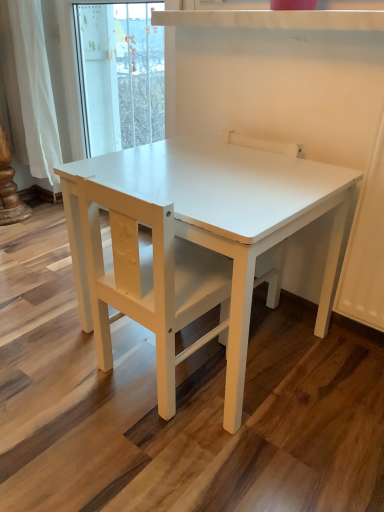
Question: Does white matte table at center have a greater height compared to white matte chair at center?

Choices:
 (A) yes
 (B) no

Answer: (B)

Question: Can you confirm if white matte table at center is smaller than white matte chair at center?

Choices:
 (A) no
 (B) yes

Answer: (A)

Question: From a real-world perspective, is white matte table at center on white matte chair at center?

Choices:
 (A) no
 (B) yes

Answer: (A)

Question: Is white matte table at center positioned far away from white matte chair at center?

Choices:
 (A) yes
 (B) no

Answer: (B)

Question: Is white matte chair at center at the back of white matte table at center?

Choices:
 (A) no
 (B) yes

Answer: (B)

Question: Would you say white matte table at center contains white matte chair at center?

Choices:
 (A) no
 (B) yes

Answer: (B)

Question: Considering the relative positions of white matte chair at center and white matte table at center in the image provided, is white matte chair at center to the left of white matte table at center from the viewer's perspective?

Choices:
 (A) yes
 (B) no

Answer: (B)

Question: Does white matte chair at center have a lesser height compared to white matte table at center?

Choices:
 (A) no
 (B) yes

Answer: (A)

Question: Is white matte chair at center beside white matte table at center?

Choices:
 (A) yes
 (B) no

Answer: (B)

Question: Does white matte chair at center have a larger size compared to white matte table at center?

Choices:
 (A) no
 (B) yes

Answer: (A)

Question: Can you confirm if white matte chair at center is wider than white matte table at center?

Choices:
 (A) no
 (B) yes

Answer: (A)

Question: Is white matte table at center at the back of white matte chair at center?

Choices:
 (A) no
 (B) yes

Answer: (B)

Question: Do you think white matte table at center is within white matte chair at center, or outside of it?

Choices:
 (A) inside
 (B) outside

Answer: (B)